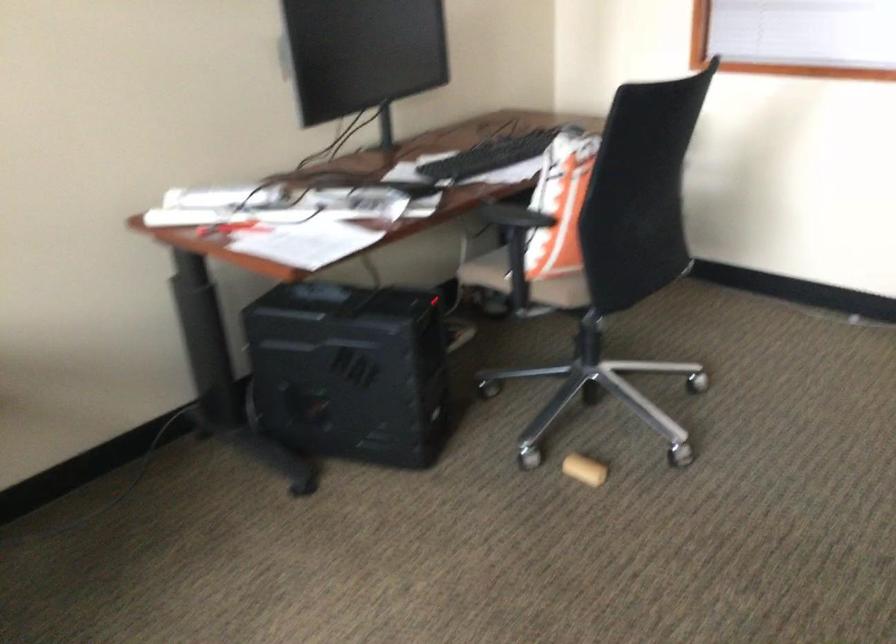
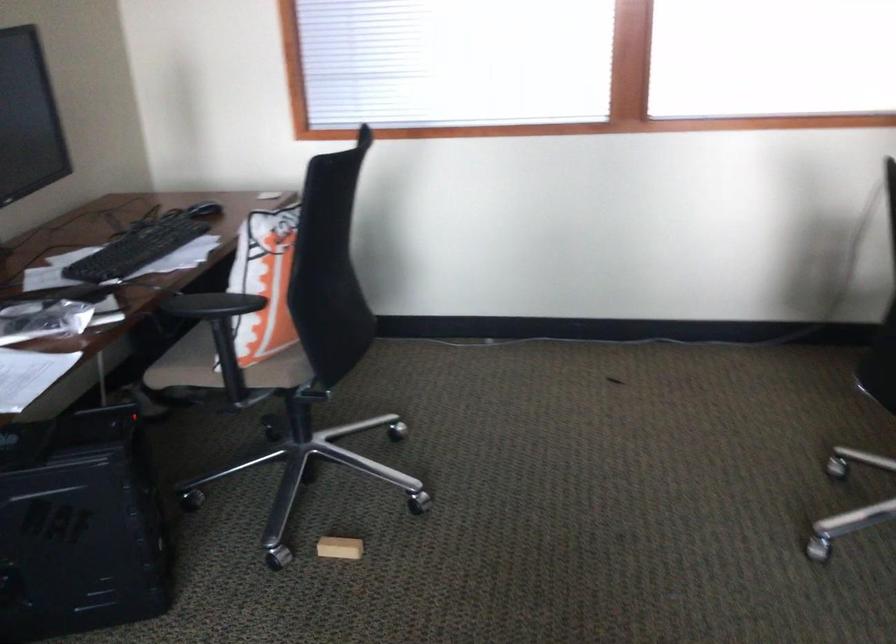
Where in the second image is the point corresponding to (589,468) from the first image?

(339, 547)